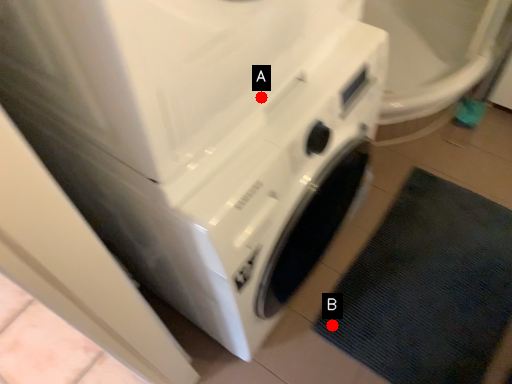
Question: Two points are circled on the image, labeled by A and B beside each circle. Which of the following is the closest to the observer?

Choices:
 (A) A is closer
 (B) B is closer

Answer: (A)